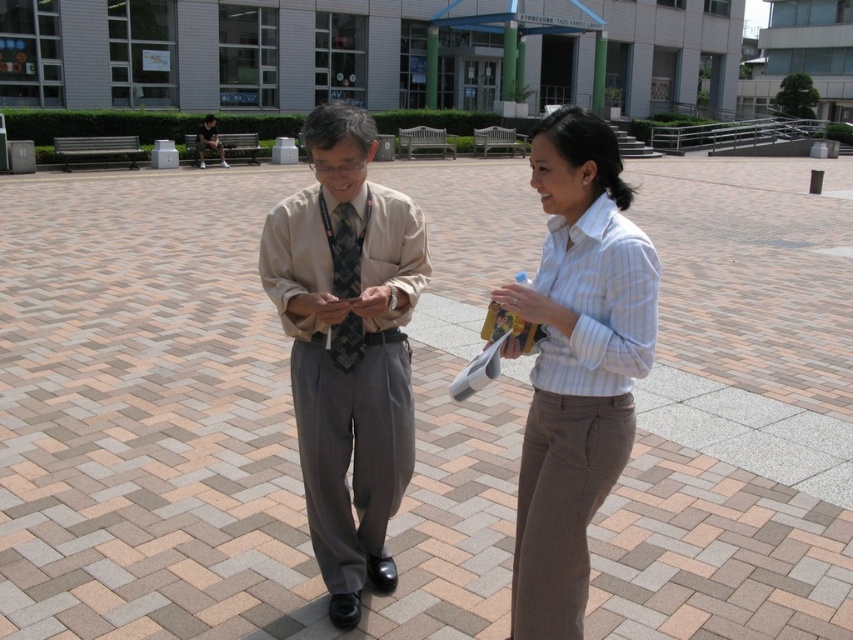
You are a tailor measuring the distance between the light brown fabric shirt at center and the dark gray textured tie at center for a custom suit. The minimum required space between them for proper fitting is 25 inches. Can the current distance accommodate the fitting requirement?

The distance between the light brown fabric shirt at center and the dark gray textured tie at center is 26.84 inches, which exceeds the minimum requirement of 25 inches. Therefore, the current distance can accommodate the fitting requirement.

You are a tailor who needs to measure the distance between two shirts displayed on a rack. The shirts are the matte beige shirt at center and the striped cotton shirt at center. The minimum space required between shirts on the rack is 25 inches. Can the shirts be placed as per the requirement?

The matte beige shirt at center and striped cotton shirt at center are 25.45 inches apart from each other. Since 25.45 inches is greater than the required 25 inches, the shirts can be placed as per the requirement.